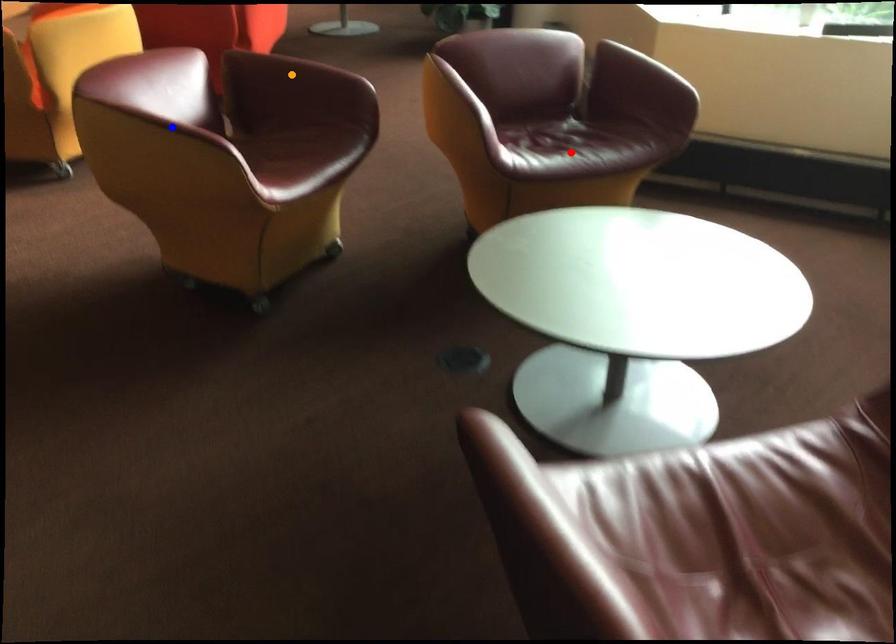
Based on the photo, order these from farthest to nearest:
blue point
red point
orange point

orange point < red point < blue point